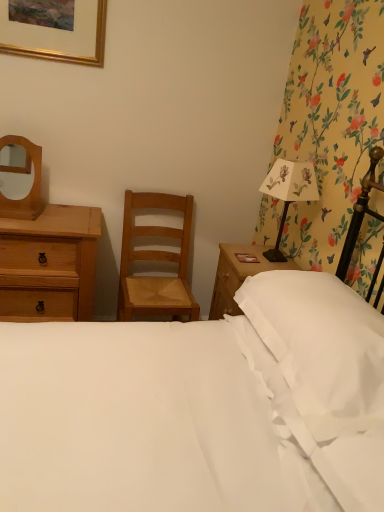
This screenshot has height=512, width=384. Describe the element at coordinates (53, 254) in the screenshot. I see `natural wood chest of drawers at left` at that location.

The image size is (384, 512). What do you see at coordinates (24, 173) in the screenshot?
I see `matte wooden mirror at upper left` at bounding box center [24, 173].

In order to click on light brown wood chair at center in this screenshot , I will do `click(155, 260)`.

I want to click on white paper lampshade at right, so click(x=289, y=192).

You are a GUI agent. You are given a task and a screenshot of the screen. Output one action in this format:
    pyautogui.click(x=<x>, y=<y>)
    Task: Click on the picture frame above the white soft pillow at right (from a real-world perspective)
    The height and width of the screenshot is (512, 384).
    Given the screenshot: What is the action you would take?
    pyautogui.click(x=54, y=30)

Does point (48, 4) come farther from viewer compared to point (288, 378)?

Yes.

Is gold metallic picture frame at upper left not inside white soft pillow at right?

That's correct, gold metallic picture frame at upper left is outside of white soft pillow at right.

Is gold metallic picture frame at upper left wider or thinner than white soft pillow at right?

Considering their sizes, gold metallic picture frame at upper left looks slimmer than white soft pillow at right.

From the image's perspective, is matte wooden mirror at upper left located above light brown wood chair at center?

Yes, from the image's perspective, matte wooden mirror at upper left is on top of light brown wood chair at center.

Which object is further away from the camera taking this photo, matte wooden mirror at upper left or light brown wood chair at center?

light brown wood chair at center.

From a real-world perspective, is matte wooden mirror at upper left physically located above or below light brown wood chair at center?

From a real-world perspective, matte wooden mirror at upper left is physically above light brown wood chair at center.

Considering the positions of point (42, 208) and point (164, 251), is point (42, 208) closer or farther from the camera than point (164, 251)?

Point (42, 208) is positioned closer to the camera compared to point (164, 251).

Considering the sizes of matte wooden mirror at upper left and white smooth bed at center in the image, is matte wooden mirror at upper left wider or thinner than white smooth bed at center?

matte wooden mirror at upper left is thinner than white smooth bed at center.

Locate an element on the screen. The image size is (384, 512). bed below the matte wooden mirror at upper left (from a real-world perspective) is located at coordinates (201, 407).

Visually, is matte wooden mirror at upper left positioned to the left or to the right of white smooth bed at center?

Clearly, matte wooden mirror at upper left is on the left of white smooth bed at center in the image.

Would you say white smooth bed at center is part of matte wooden mirror at upper left's contents?

That's incorrect, white smooth bed at center is not inside matte wooden mirror at upper left.

Which of these two, natural wood chest of drawers at left or white soft pillow at right, is smaller?

With smaller size is white soft pillow at right.

In terms of height, does natural wood chest of drawers at left look taller or shorter compared to white soft pillow at right?

Considering their sizes, natural wood chest of drawers at left has more height than white soft pillow at right.

Is natural wood chest of drawers at left positioned far away from white soft pillow at right?

natural wood chest of drawers at left is far away from white soft pillow at right.

Based on the photo, from the image's perspective, is natural wood chest of drawers at left on white soft pillow at right?

Yes, from the image's perspective, natural wood chest of drawers at left is over white soft pillow at right.

Considering the relative sizes of light brown wood chair at center and natural wood chest of drawers at left in the image provided, is light brown wood chair at center thinner than natural wood chest of drawers at left?

Yes, light brown wood chair at center is thinner than natural wood chest of drawers at left.

From the image's perspective, who appears lower, light brown wood chair at center or natural wood chest of drawers at left?

natural wood chest of drawers at left is shown below in the image.

Can we say light brown wood chair at center lies outside natural wood chest of drawers at left?

light brown wood chair at center is positioned outside natural wood chest of drawers at left.

Is white smooth bed at center oriented away from light brown wood chair at center?

No, light brown wood chair at center is not at the back of white smooth bed at center.

From the image's perspective, between white smooth bed at center and light brown wood chair at center, who is located below?

white smooth bed at center, from the image's perspective.

Is white smooth bed at center at the left side of light brown wood chair at center?

No, white smooth bed at center is not to the left of light brown wood chair at center.

Where is `bed above the light brown wood chair at center (from a real-world perspective)`? The width and height of the screenshot is (384, 512). bed above the light brown wood chair at center (from a real-world perspective) is located at coordinates (201, 407).

Which of these two, light brown wood chair at center or matte wooden mirror at upper left, stands taller?

light brown wood chair at center.

From a real-world perspective, is light brown wood chair at center above or below matte wooden mirror at upper left?

light brown wood chair at center is below matte wooden mirror at upper left.

Looking at this image, is light brown wood chair at center directly adjacent to matte wooden mirror at upper left?

No, light brown wood chair at center is not beside matte wooden mirror at upper left.

Who is more distant, light brown wood chair at center or matte wooden mirror at upper left?

light brown wood chair at center is further from the camera.

Image resolution: width=384 pixels, height=512 pixels. I want to click on picture frame to the left of white soft pillow at right, so click(x=54, y=30).

I want to click on mirror above the light brown wood chair at center (from a real-world perspective), so click(24, 173).

From the image, which object appears to be farther from white smooth bed at center, white soft pillow at right or white paper lampshade at right?

white paper lampshade at right is further to white smooth bed at center.

Looking at the image, which one is located closer to white paper lampshade at right, matte wooden mirror at upper left or gold metallic picture frame at upper left?

The object closer to white paper lampshade at right is gold metallic picture frame at upper left.

Considering their positions, is light brown wood chair at center positioned closer to white paper lampshade at right than gold metallic picture frame at upper left?

light brown wood chair at center.

Estimate the real-world distances between objects in this image. Which object is closer to white paper lampshade at right, white soft pillow at right or natural wood chest of drawers at left?

white soft pillow at right.

Based on their spatial positions, is matte wooden mirror at upper left or white smooth bed at center further from gold metallic picture frame at upper left?

Among the two, white smooth bed at center is located further to gold metallic picture frame at upper left.

Based on their spatial positions, is white paper lampshade at right or light brown wood chair at center further from white soft pillow at right?

Among the two, light brown wood chair at center is located further to white soft pillow at right.

Looking at the image, which one is located closer to matte wooden mirror at upper left, white smooth bed at center or natural wood chest of drawers at left?

Among the two, natural wood chest of drawers at left is located nearer to matte wooden mirror at upper left.

Considering their positions, is gold metallic picture frame at upper left positioned further to white paper lampshade at right than white soft pillow at right?

gold metallic picture frame at upper left.

Locate an element on the screen. pillow located between white smooth bed at center and matte wooden mirror at upper left in the depth direction is located at coordinates (321, 347).

Find the location of `pillow located between natural wood chest of drawers at left and white paper lampshade at right in the left-right direction`. pillow located between natural wood chest of drawers at left and white paper lampshade at right in the left-right direction is located at coordinates (321, 347).

Locate an element on the screen. This screenshot has width=384, height=512. the chest of drawers located between white smooth bed at center and light brown wood chair at center in the depth direction is located at coordinates (53, 254).

Locate an element on the screen. chair between matte wooden mirror at upper left and white paper lampshade at right in the horizontal direction is located at coordinates (155, 260).